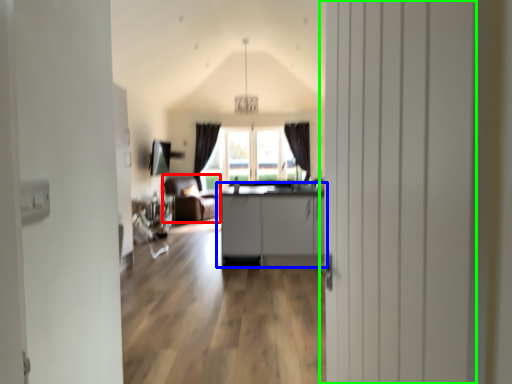
Question: Which is farther away from armchair (highlighted by a red box)? cabinetry (highlighted by a blue box) or door (highlighted by a green box)?

Choices:
 (A) cabinetry
 (B) door

Answer: (B)